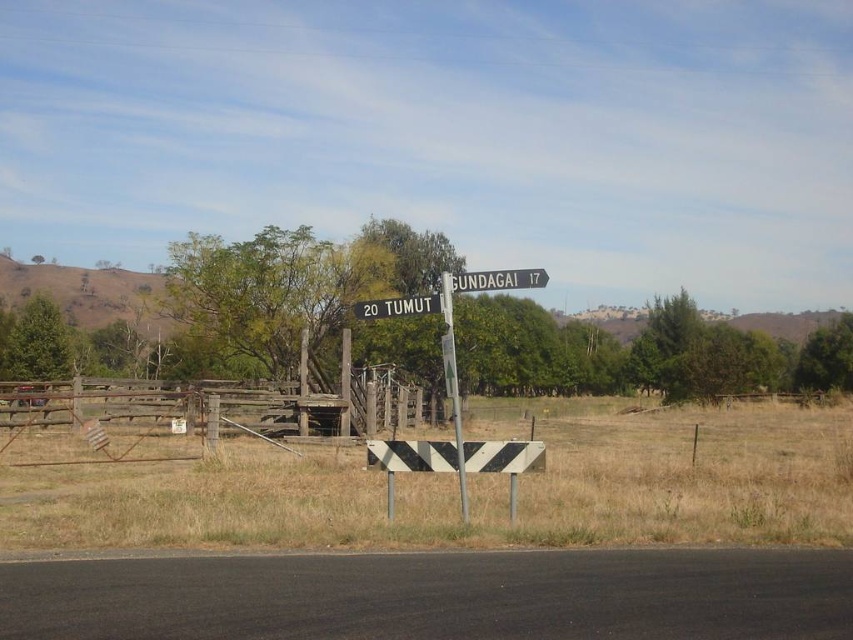
You are a delivery driver who needs to attach a safety chain between the metallic pole at center and the white plastic road sign at upper center. The chain you have is 4 meters long. Based on the scene described, will the chain be long enough?

The distance between the metallic pole at center and the white plastic road sign at upper center is 4.32 meters. Since the chain is only 4 meters long, it will not be sufficient to span the distance between them.

You are a driver approaching the intersection and see the metallic pole at center and the white plastic road sign at upper center. Which object would appear closer to you as you drive towards them?

The metallic pole at center appears closer because it is larger in size than the white plastic road sign at upper center, indicating it is nearer to the driver.

You are standing at the point closer to the signpost in the rural scene. Which point are you at, point (315, 419) or point (386, 314)?

You are at point (386, 314) because it is closer to the signpost than point (315, 419), which is further away from the signpost.